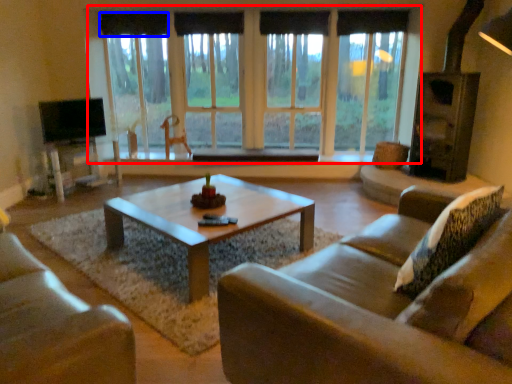
Question: Which of the following is the farthest to the observer, window (highlighted by a red box) or curtain (highlighted by a blue box)?

Choices:
 (A) window
 (B) curtain

Answer: (B)